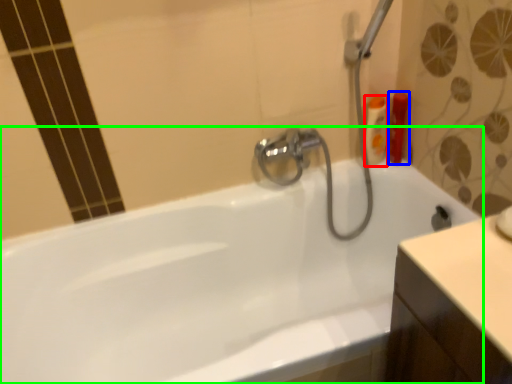
Question: Which is nearer to the toiletry (highlighted by a red box)? toiletry (highlighted by a blue box) or bathtub (highlighted by a green box).

Choices:
 (A) toiletry
 (B) bathtub

Answer: (A)